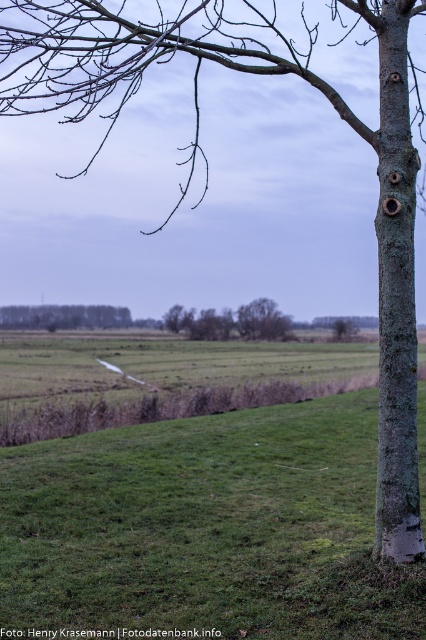
Is green mossy bark tree trunk at right further to the viewer compared to brown rough tree at center?

That is False.

Can you confirm if green mossy bark tree trunk at right is positioned to the left of brown rough tree at center?

No, green mossy bark tree trunk at right is not to the left of brown rough tree at center.

At what (x,y) coordinates should I click in order to perform the action: click on green mossy bark tree trunk at right. Please return your answer as a coordinate pair (x, y). Looking at the image, I should click on (396, 291).

What are the coordinates of `green mossy bark tree trunk at right` in the screenshot? It's located at (396, 291).

Identify the location of brown rough tree at center. This screenshot has height=640, width=426. (230, 321).

Which is behind, point (261, 330) or point (94, 305)?

Point (94, 305)

You are a GUI agent. You are given a task and a screenshot of the screen. Output one action in this format:
    pyautogui.click(x=<x>, y=<y>)
    Task: Click on the brown rough tree at center
    
    Given the screenshot: What is the action you would take?
    pyautogui.click(x=230, y=321)

Image resolution: width=426 pixels, height=640 pixels. Describe the element at coordinates (396, 291) in the screenshot. I see `green mossy bark tree trunk at right` at that location.

Which is more to the left, green mossy bark tree trunk at right or green grassy field at lower left?

From the viewer's perspective, green grassy field at lower left appears more on the left side.

Who is more distant from viewer, (386, 116) or (46, 324)?

Positioned behind is point (46, 324).

Locate an element on the screen. The width and height of the screenshot is (426, 640). green mossy bark tree trunk at right is located at coordinates pos(396,291).